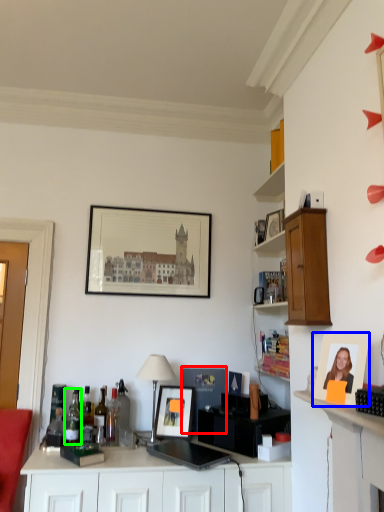
Question: Which is nearer to the picture frame (highlighted by a red box)? picture frame (highlighted by a blue box) or bottle (highlighted by a green box).

Choices:
 (A) picture frame
 (B) bottle

Answer: (B)